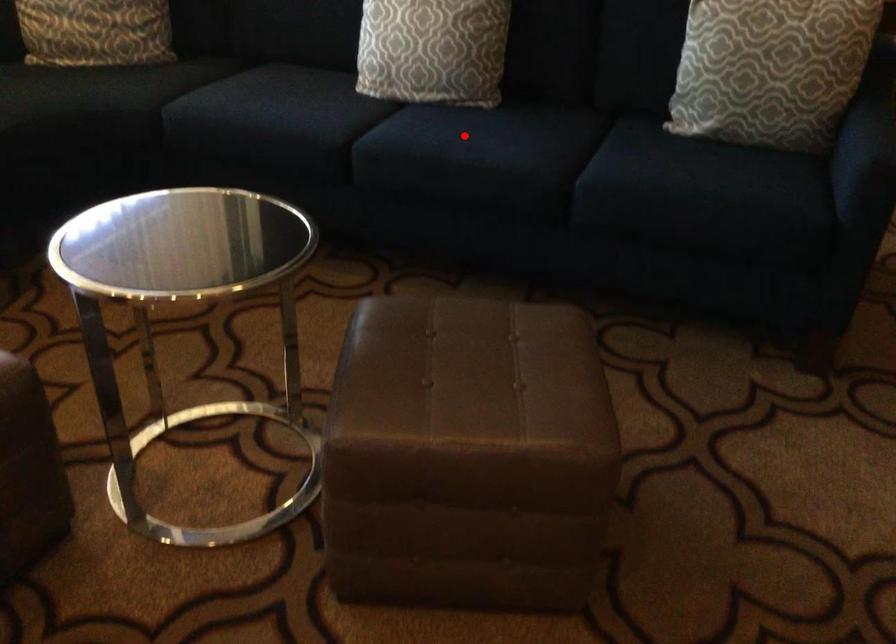
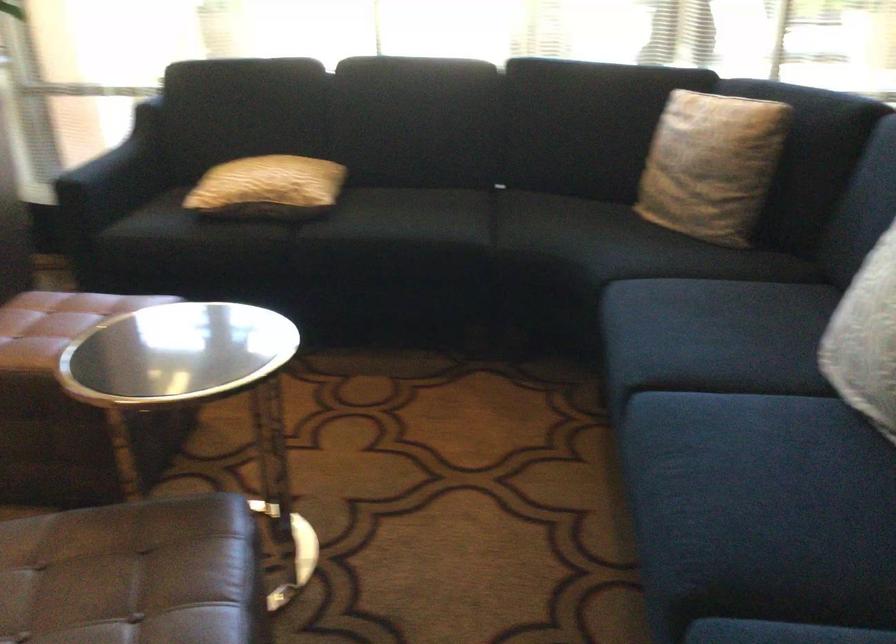
In the second image, find the point that corresponds to the highlighted location in the first image.

(745, 459)